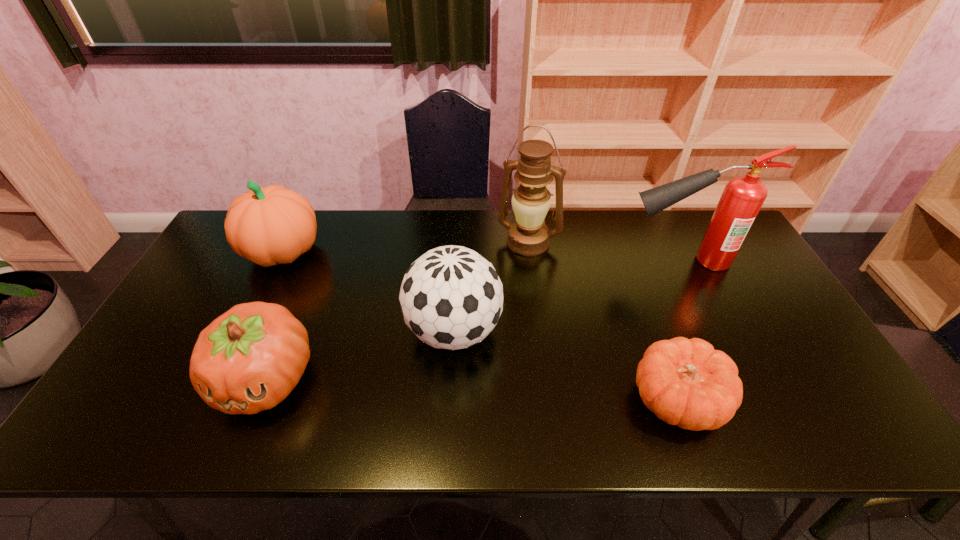
The width and height of the screenshot is (960, 540). I want to click on vacant region located 0.160m at the nozzle of the fire extinguisher, so click(x=570, y=261).

Where is `vacant space located on the right of the farthest pumpkin`? vacant space located on the right of the farthest pumpkin is located at coordinates (342, 252).

This screenshot has height=540, width=960. Identify the location of vacant space located on the back of the fourth object from right to left. (457, 284).

Identify the location of blank space located on the left of the rightmost pumpkin. The width and height of the screenshot is (960, 540). (539, 401).

Where is `oil lamp present at the far edge`? The height and width of the screenshot is (540, 960). oil lamp present at the far edge is located at coordinates (529, 236).

Image resolution: width=960 pixels, height=540 pixels. What are the coordinates of `fire extinguisher that is at the far edge` in the screenshot? It's located at (743, 196).

I want to click on pumpkin at the far edge, so click(x=272, y=225).

In order to click on object that is at the left edge in this screenshot , I will do `click(272, 225)`.

Image resolution: width=960 pixels, height=540 pixels. Identify the location of object present at the right edge. (743, 196).

Identify the location of object that is at the far left corner. Image resolution: width=960 pixels, height=540 pixels. [x=272, y=225].